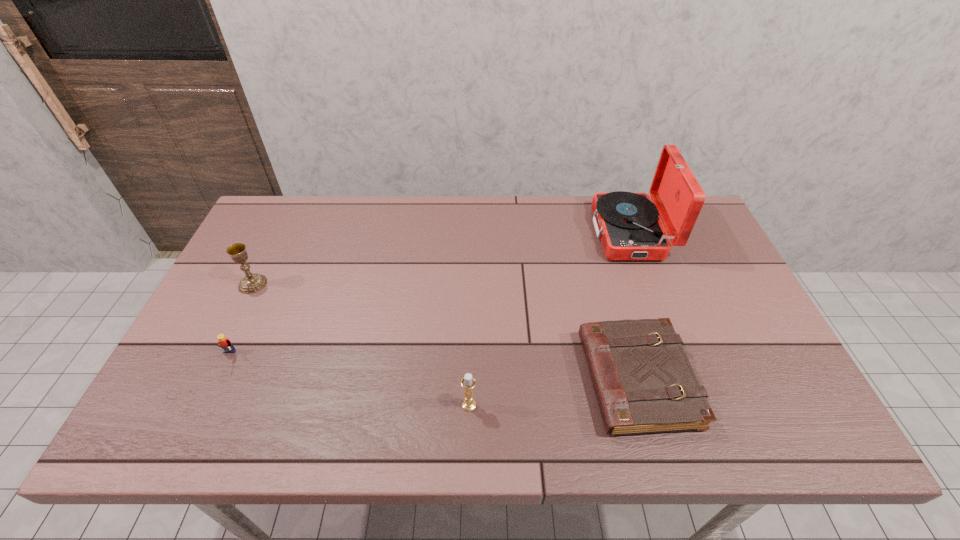
Where is `free spot located 0.380m on the right of the third object from left to right`? This screenshot has height=540, width=960. free spot located 0.380m on the right of the third object from left to right is located at coordinates (645, 405).

This screenshot has height=540, width=960. I want to click on vacant area situated on the front-facing side of the fourth tallest object, so click(209, 395).

Locate an element on the screen. The width and height of the screenshot is (960, 540). vacant space situated on the right of the hardback book is located at coordinates (778, 379).

The width and height of the screenshot is (960, 540). Identify the location of object at the far edge. (629, 227).

I want to click on candle holder at the near edge, so click(468, 382).

Identify the location of hardback book that is at the near edge. This screenshot has height=540, width=960. (643, 380).

The height and width of the screenshot is (540, 960). Identify the location of chalice present at the left edge. (251, 283).

Locate an element on the screen. The width and height of the screenshot is (960, 540). Lego that is at the left edge is located at coordinates (224, 343).

Locate an element on the screen. object that is positioned at the right edge is located at coordinates (629, 227).

This screenshot has height=540, width=960. In order to click on object present at the far right corner in this screenshot , I will do `click(629, 227)`.